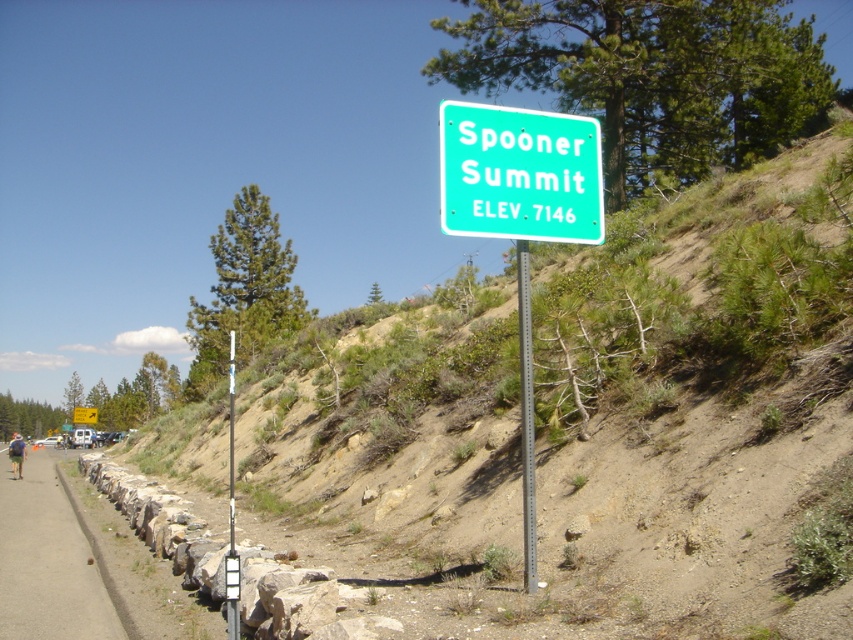
Between point (514, 193) and point (73, 417), which one is positioned in front?

Point (514, 193) is more forward.

Is point (538, 195) farther from viewer compared to point (88, 420)?

No, (538, 195) is in front of (88, 420).

Identify the location of green matte sign at upper center. Image resolution: width=853 pixels, height=640 pixels. (519, 173).

Does green plastic sign at center appear on the right side of orange fabric backpack at lower left?

Correct, you'll find green plastic sign at center to the right of orange fabric backpack at lower left.

Is green plastic sign at center positioned in front of orange fabric backpack at lower left?

Yes, it is in front of orange fabric backpack at lower left.

Is point (448, 193) less distant than point (10, 449)?

Yes, it is.

Find the location of a particular element. green plastic sign at center is located at coordinates (520, 216).

Who is shorter, smooth asphalt path at lower left or green plastic arrow at upper right?

green plastic arrow at upper right

Can you confirm if smooth asphalt path at lower left is positioned above green plastic arrow at upper right?

Yes, smooth asphalt path at lower left is above green plastic arrow at upper right.

Which is in front, point (86, 596) or point (91, 422)?

Positioned in front is point (86, 596).

Locate an element on the screen. The height and width of the screenshot is (640, 853). smooth asphalt path at lower left is located at coordinates (47, 563).